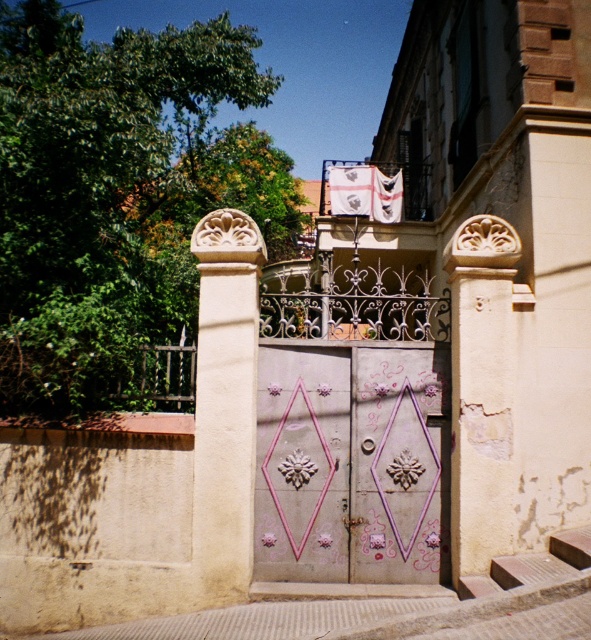
Is pink painted wood door at center to the left of white stone column at center from the viewer's perspective?

No, pink painted wood door at center is not to the left of white stone column at center.

Between point (427, 394) and point (202, 392), which one is positioned behind?

The point (427, 394) is more distant.

The height and width of the screenshot is (640, 591). What are the coordinates of `pink painted wood door at center` in the screenshot? It's located at (350, 464).